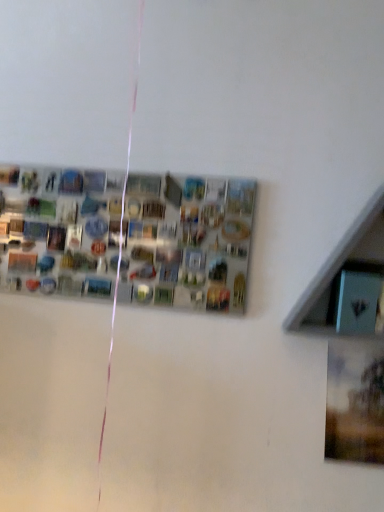
Question: From a real-world perspective, relative to metallic silver bulletin board at center, is blue glossy shelf at upper right vertically above or below?

Choices:
 (A) below
 (B) above

Answer: (B)

Question: Is blue glossy shelf at upper right situated inside metallic silver bulletin board at center or outside?

Choices:
 (A) inside
 (B) outside

Answer: (B)

Question: In terms of width, does blue glossy shelf at upper right look wider or thinner when compared to metallic silver bulletin board at center?

Choices:
 (A) wide
 (B) thin

Answer: (A)

Question: Is metallic silver bulletin board at center in front of or behind blue glossy shelf at upper right in the image?

Choices:
 (A) front
 (B) behind

Answer: (B)

Question: Choose the correct answer: Is metallic silver bulletin board at center inside blue glossy shelf at upper right or outside it?

Choices:
 (A) outside
 (B) inside

Answer: (A)

Question: Is metallic silver bulletin board at center taller or shorter than blue glossy shelf at upper right?

Choices:
 (A) short
 (B) tall

Answer: (A)

Question: From a real-world perspective, relative to blue glossy shelf at upper right, is metallic silver bulletin board at center vertically above or below?

Choices:
 (A) above
 (B) below

Answer: (B)